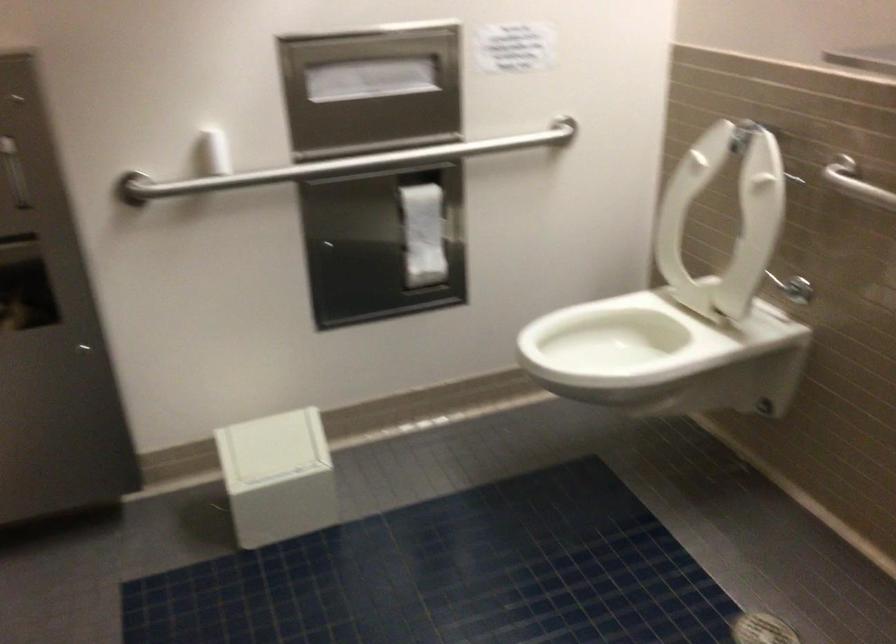
This screenshot has height=644, width=896. Identify the location of white toilet lid. (724, 219).